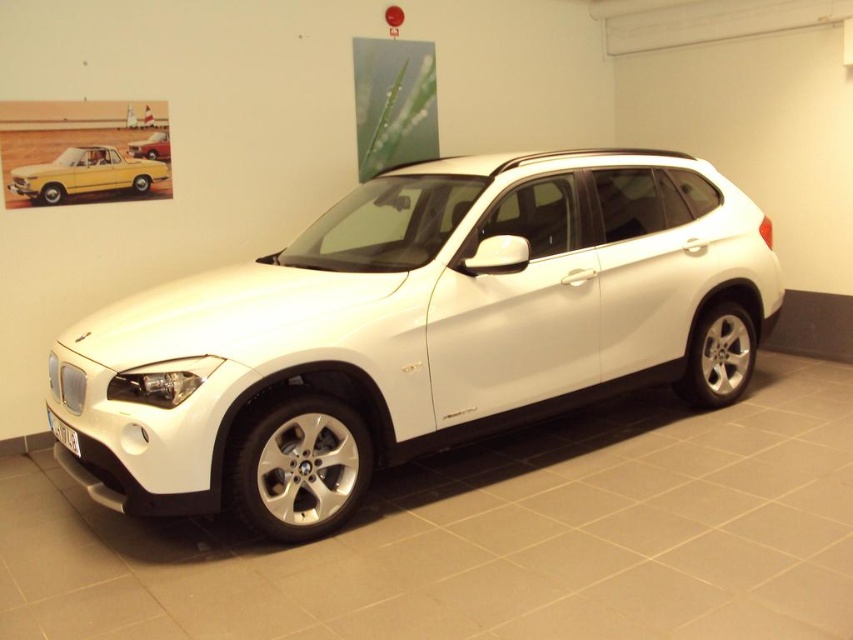
Between white metallic car at center and yellow matte vintage car at upper left, which one is positioned lower?

white metallic car at center is lower down.

Is white metallic car at center taller than yellow matte vintage car at upper left?

Yes, white metallic car at center is taller than yellow matte vintage car at upper left.

This screenshot has height=640, width=853. In order to click on white metallic car at center in this screenshot , I will do `click(415, 332)`.

Who is higher up, yellow matte vintage car at upper left or matte black car at upper left?

matte black car at upper left is higher up.

Does point (164, 173) come behind point (158, 145)?

Yes, point (164, 173) is behind point (158, 145).

Image resolution: width=853 pixels, height=640 pixels. I want to click on yellow matte vintage car at upper left, so click(85, 173).

Locate an element on the screen. white metallic car at center is located at coordinates (415, 332).

Is white metallic car at center thinner than matte black car at upper left?

No, white metallic car at center is not thinner than matte black car at upper left.

Which is in front, point (500, 422) or point (149, 154)?

Positioned in front is point (500, 422).

Identify the location of white metallic car at center. (415, 332).